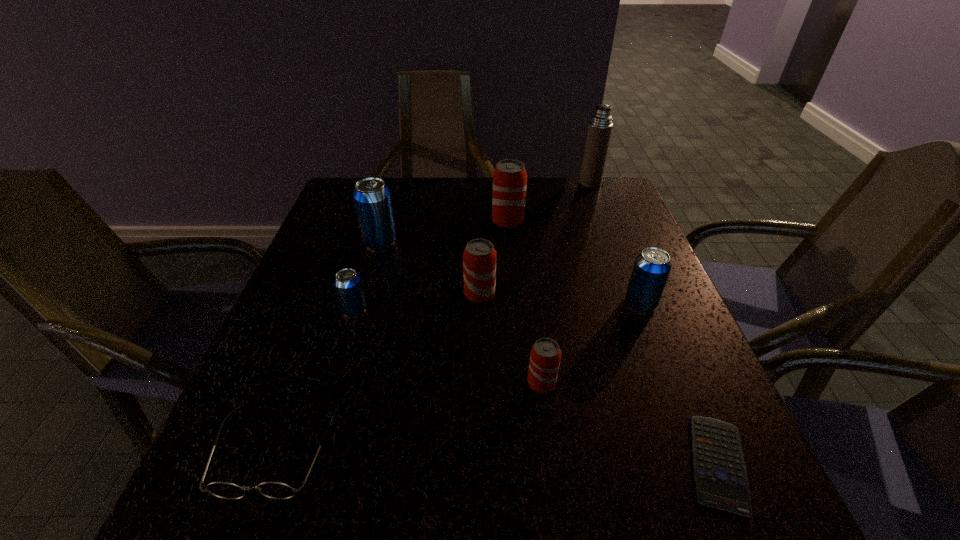
Where is `free space located 0.320m on the front of the smallest blue beer can`? free space located 0.320m on the front of the smallest blue beer can is located at coordinates (307, 469).

Where is `vacant space positioned 0.090m on the front of the nearest orange beer can`? The image size is (960, 540). vacant space positioned 0.090m on the front of the nearest orange beer can is located at coordinates (549, 442).

This screenshot has height=540, width=960. Find the location of `vacant space situated 0.200m on the back of the shortest object`. vacant space situated 0.200m on the back of the shortest object is located at coordinates (662, 330).

Identify the location of thermos bottle at the far edge. (600, 126).

Where is `beer can that is at the far edge`? beer can that is at the far edge is located at coordinates (509, 177).

Find the location of a particular element. The image size is (960, 540). spectacles located at the near edge is located at coordinates (275, 490).

Identify the location of calculator that is at the near edge. The image size is (960, 540). [x=721, y=481].

The width and height of the screenshot is (960, 540). Identify the location of spectacles that is at the left edge. (275, 490).

The width and height of the screenshot is (960, 540). What are the coordinates of `thermos bottle at the right edge` in the screenshot? It's located at (600, 126).

Identify the location of beer can positioned at the right edge. The image size is (960, 540). (651, 269).